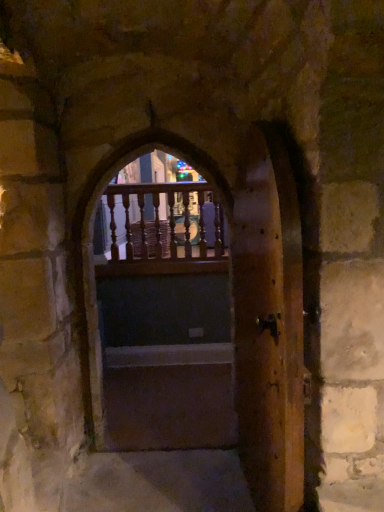
Question: From a real-world perspective, is wooden balusters at center physically above wooden door at center, acting as the first door starting from the left?

Choices:
 (A) no
 (B) yes

Answer: (B)

Question: Considering the relative positions of wooden balusters at center and wooden door at center, acting as the first door starting from the left, in the image provided, is wooden balusters at center to the left of wooden door at center, acting as the first door starting from the left, from the viewer's perspective?

Choices:
 (A) no
 (B) yes

Answer: (B)

Question: Does wooden balusters at center turn towards wooden door at center, acting as the first door starting from the left?

Choices:
 (A) yes
 (B) no

Answer: (A)

Question: Is wooden door at center, the second door positioned from the right, a part of wooden balusters at center?

Choices:
 (A) no
 (B) yes

Answer: (A)

Question: Is wooden balusters at center with wooden door at center, the second door positioned from the right?

Choices:
 (A) no
 (B) yes

Answer: (A)

Question: From a real-world perspective, is wooden balusters at center above or below dark wood door at center?

Choices:
 (A) above
 (B) below

Answer: (A)

Question: From their relative heights in the image, would you say wooden balusters at center is taller or shorter than dark wood door at center?

Choices:
 (A) tall
 (B) short

Answer: (A)

Question: Is wooden balusters at center inside or outside of dark wood door at center?

Choices:
 (A) outside
 (B) inside

Answer: (A)

Question: Does point (120, 201) appear closer or farther from the camera than point (180, 414)?

Choices:
 (A) farther
 (B) closer

Answer: (A)

Question: Is wooden door at center, the first door viewed from the right, inside the boundaries of wooden balusters at center, or outside?

Choices:
 (A) outside
 (B) inside

Answer: (A)

Question: Considering the positions of point (268, 475) and point (185, 224), is point (268, 475) closer or farther from the camera than point (185, 224)?

Choices:
 (A) closer
 (B) farther

Answer: (A)

Question: Is wooden door at center, the first door viewed from the right, to the left or to the right of wooden balusters at center in the image?

Choices:
 (A) right
 (B) left

Answer: (A)

Question: From the image's perspective, is wooden door at center, the first door viewed from the right, positioned above or below wooden balusters at center?

Choices:
 (A) above
 (B) below

Answer: (B)

Question: From a real-world perspective, is wooden door at center, the second door positioned from the right, physically located above or below wooden balusters at center?

Choices:
 (A) below
 (B) above

Answer: (A)

Question: From their relative heights in the image, would you say wooden door at center, acting as the first door starting from the left, is taller or shorter than wooden balusters at center?

Choices:
 (A) tall
 (B) short

Answer: (A)